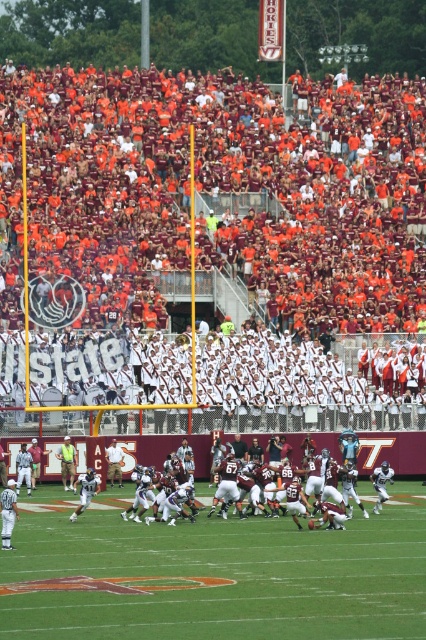
Based on the photo, you are a photographer trying to capture a wide shot of the green grass football field at center while also including the maroon fabric seats at upper center in the frame. Based on their positions, which side of the football field should you position yourself to ensure both elements are visible?

The maroon fabric seats at upper center are on the left side of the green grass football field at center, so positioning yourself to the right side of the football field would allow you to include both the football field and the seats in your shot.

You are a photographer standing at the edge of the field. You want to take a photo that includes both the green grass football field at center and the maroon uniformed players at center. Based on their positions, which object will appear larger in the photo?

The green grass football field at center will appear larger in the photo because it is closer to the viewer than the maroon uniformed players at center.

You are a spectator at the football game and want to take a photo of both the green grass football field at center and the maroon uniformed players at center. Based on their positions, which object should you frame first in your camera viewfinder to ensure both are in the shot?

The green grass football field at center is positioned on the left side of maroon uniformed players at center, so you should frame the green grass football field at center first to ensure both are in the shot since it is on the left side.